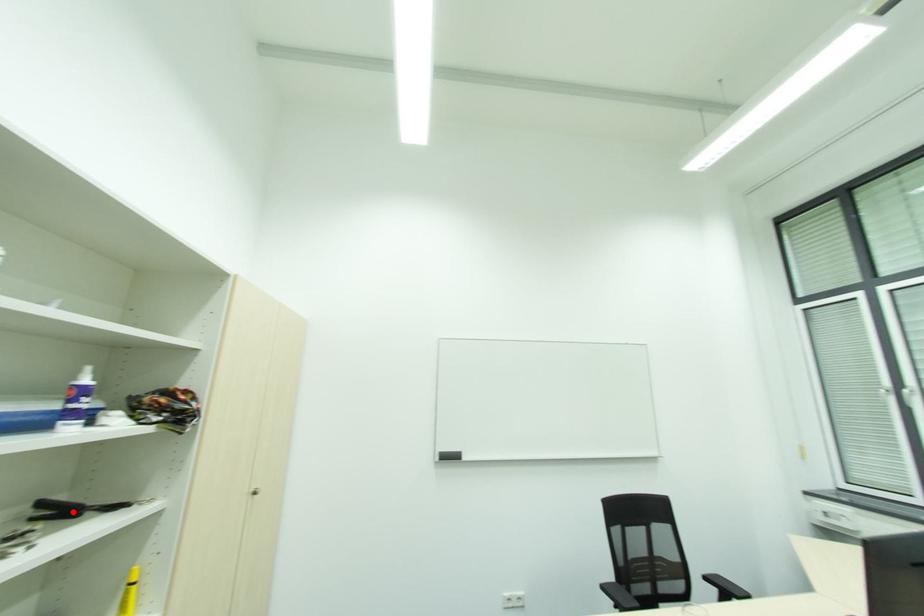
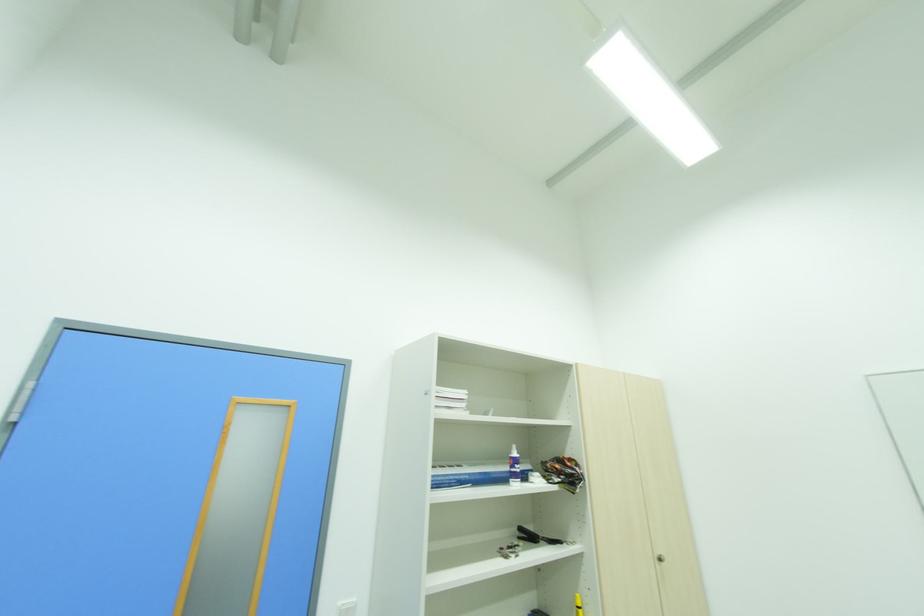
Find the pixel in the second image that matches the highlighted location in the first image.

(536, 539)